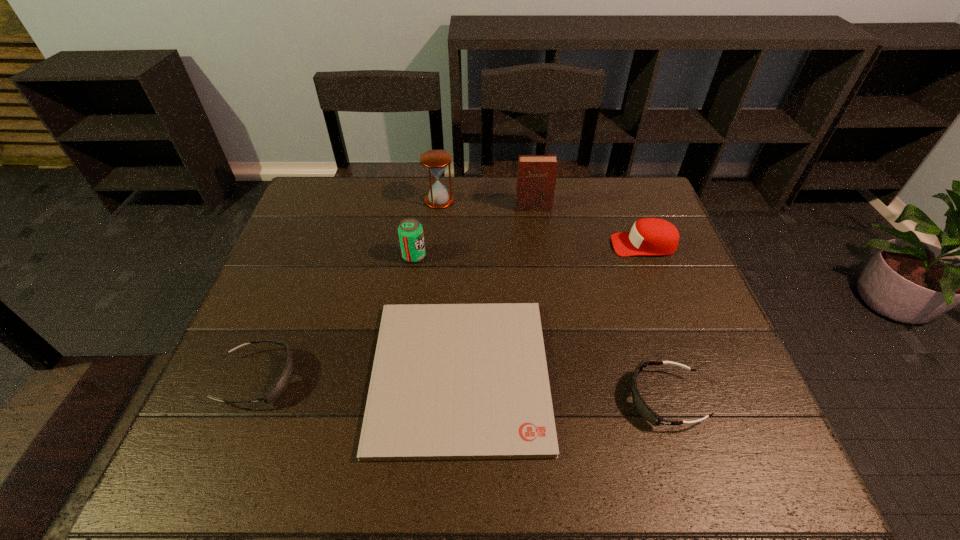
Find the location of `vacant space that's between the shortest object and the leftmost object`. vacant space that's between the shortest object and the leftmost object is located at coordinates (359, 376).

Where is `free spot between the right goggles and the hourglass`? This screenshot has height=540, width=960. free spot between the right goggles and the hourglass is located at coordinates (552, 300).

Locate an element on the screen. free space between the fourth tallest object and the pop soda is located at coordinates (529, 251).

The image size is (960, 540). Find the location of `unoccupied area between the hourglass and the clipboard`. unoccupied area between the hourglass and the clipboard is located at coordinates (449, 287).

Find the location of a particular element. empty space that is in between the pop soda and the hourglass is located at coordinates (426, 228).

Where is `vacant region between the right goggles and the hourglass`? This screenshot has height=540, width=960. vacant region between the right goggles and the hourglass is located at coordinates (552, 300).

Where is `unoccupied area between the leftmost object and the hourglass`? The height and width of the screenshot is (540, 960). unoccupied area between the leftmost object and the hourglass is located at coordinates (348, 289).

The width and height of the screenshot is (960, 540). In order to click on unoccupied area between the clipboard and the hourglass in this screenshot , I will do `click(449, 287)`.

Where is `the fifth closest object to the right goggles`? This screenshot has width=960, height=540. the fifth closest object to the right goggles is located at coordinates (436, 161).

Locate which object is the closest to the diary. Please provide its 2D coordinates. Your answer should be formatted as a tuple, i.e. [(x, y)], where the tuple contains the x and y coordinates of a point satisfying the conditions above.

[(649, 236)]